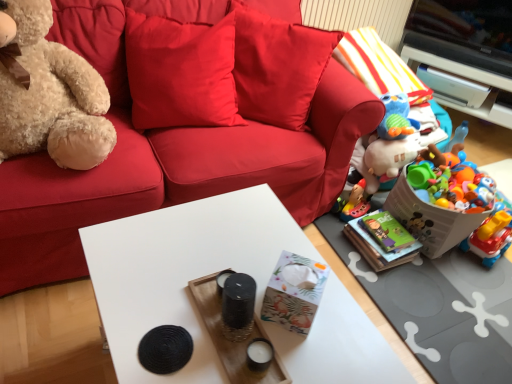
The width and height of the screenshot is (512, 384). Identify the location of free space in front of floral paper tissue box at center, which is the 1th box from front to back. click(294, 357).